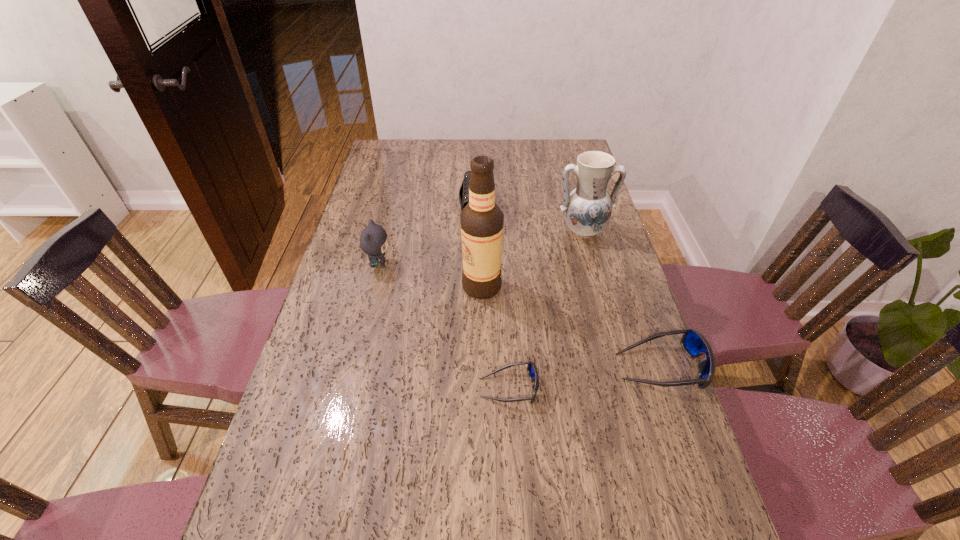
You are a GUI agent. You are given a task and a screenshot of the screen. Output one action in this format:
    pyautogui.click(x=<x>, y=<y>)
    Task: Click on the vacant position at the left edge of the desktop
    This screenshot has width=960, height=540.
    Given the screenshot: What is the action you would take?
    pyautogui.click(x=407, y=183)

In order to click on vacant area at the right edge of the desktop in this screenshot , I will do `click(628, 407)`.

The width and height of the screenshot is (960, 540). What are the coordinates of `free spot at the far left corner of the desktop` in the screenshot? It's located at pos(408,156).

In the image, there is a desktop. At what (x,y) coordinates should I click in order to perform the action: click on free space at the near right corner. Please return your answer as a coordinate pair (x, y). This screenshot has height=540, width=960. Looking at the image, I should click on (687, 500).

Identify the location of empty space that is in between the fourth tallest object and the fourth shortest object. (427, 239).

At what (x,y) coordinates should I click in order to perform the action: click on free spot between the alcohol and the shorter sunglasses. Please return your answer as a coordinate pair (x, y). Looking at the image, I should click on (495, 337).

Locate an element on the screen. vacant space in between the taller sunglasses and the pottery is located at coordinates (622, 299).

This screenshot has width=960, height=540. In order to click on vacant space that is in between the kitten and the alcohol in this screenshot , I will do `click(430, 275)`.

Identify the location of vacant area that lies between the leftmost object and the tallest object. The image size is (960, 540). (430, 275).

This screenshot has height=540, width=960. I want to click on vacant region between the leftmost object and the shortest object, so tap(444, 326).